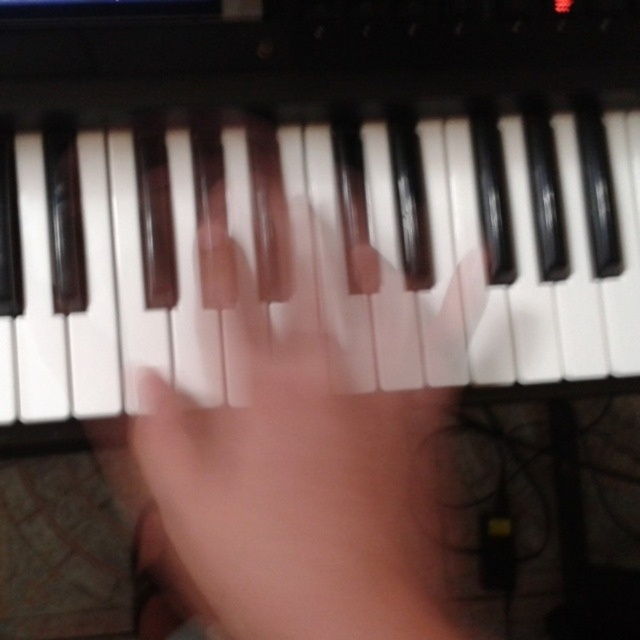
You are a photographer trying to capture a close up of the keyboard. You are currently standing at the point marked as point [200,186]. To ensure the keyboard is in focus, you need to be at least 24 inches away from the camera. Is your current position sufficient?

The point [200,186] and camera are 24.75 inches apart from each other. Since 24.75 inches is more than 24 inches, your current position is sufficient to ensure the keyboard is in focus.

You are a photographer adjusting the focus of your camera. You need to focus on either the point at point (45, 410) or point (472, 269). Which point should you choose to ensure the foreground is sharp?

Point (45, 410) is closer to the viewer than point (472, 269), so focusing on point (45, 410) will ensure the foreground is sharp.

You are a photographer setting up a shot of a hand on a keyboard. The scene requires the hand to be in focus while the keys remain slightly blurred. Given the white matte piano keys at center and the satin black hand at center, which object should you adjust the camera focus on to ensure the hand is sharp and the keys are blurred?

The white matte piano keys at center are wider than the satin black hand at center. To achieve the desired focus on the hand while keeping the keys blurred, adjust the camera focus on the satin black hand at center.